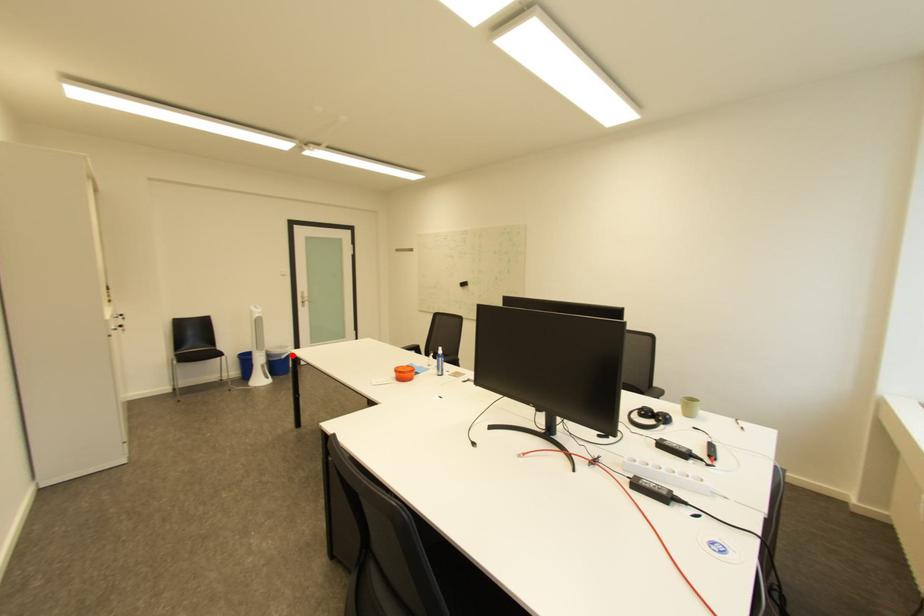
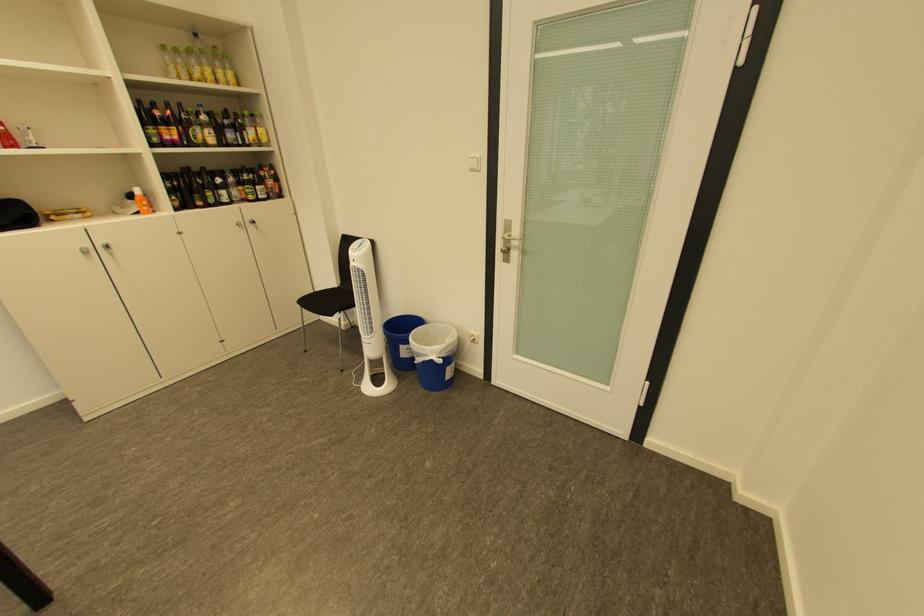
Question: I am providing you with two images of the same scene from different viewpoints. Given a red point in image1, look at the same physical point in image2. Is it:

Choices:
 (A) Closer to the viewpoint
 (B) Farther from the viewpoint

Answer: (B)